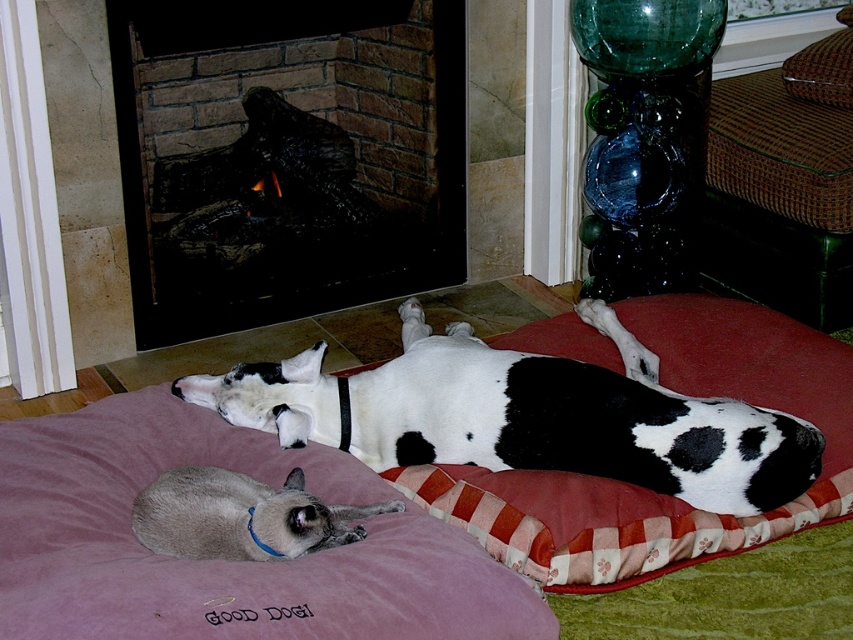
Find the location of `brick fireplace at upper left`. brick fireplace at upper left is located at coordinates coord(286,156).

Does point (175, 301) come in front of point (339, 444)?

No.

Is point (287, 180) behind point (648, 397)?

That is True.

Find the location of `brick fireplace at upper left`. brick fireplace at upper left is located at coordinates (286, 156).

Does purple suede dog bed at center appear over velvet purple cat bed at lower left?

Yes.

Does purple suede dog bed at center come behind velvet purple cat bed at lower left?

Yes, it is behind velvet purple cat bed at lower left.

Where is `purple suede dog bed at center`? This screenshot has height=640, width=853. purple suede dog bed at center is located at coordinates (219, 561).

Locate an element on the screen. This screenshot has height=640, width=853. purple suede dog bed at center is located at coordinates (219, 561).

Between velvet purple cat bed at lower left and silky gray cat at lower left, which one has more height?

With more height is velvet purple cat bed at lower left.

Locate an element on the screen. The height and width of the screenshot is (640, 853). velvet purple cat bed at lower left is located at coordinates (219, 561).

At what (x,y) coordinates should I click in order to perform the action: click on velvet purple cat bed at lower left. Please return your answer as a coordinate pair (x, y). The height and width of the screenshot is (640, 853). Looking at the image, I should click on (219, 561).

Where is `velvet purple cat bed at lower left`? velvet purple cat bed at lower left is located at coordinates (219, 561).